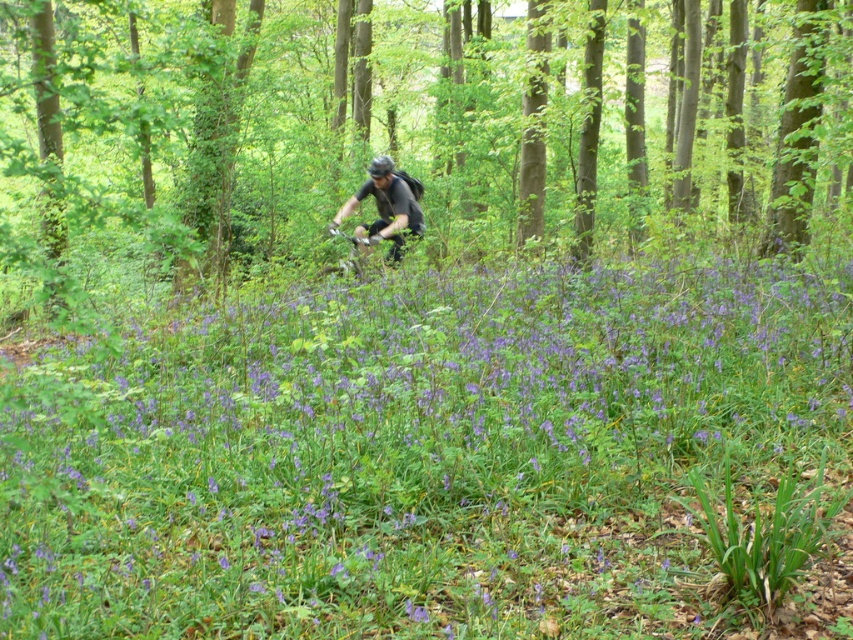
Does purple matte flowers at center have a smaller size compared to shiny black helmet at center?

Correct, purple matte flowers at center occupies less space than shiny black helmet at center.

Who is more distant from viewer, (663, 332) or (381, 168)?

The point (381, 168) is more distant.

Where is `purple matte flowers at center`? purple matte flowers at center is located at coordinates (415, 452).

Is purple matte flowers at center shorter than green leafy tree at center?

Indeed, purple matte flowers at center has a lesser height compared to green leafy tree at center.

Between purple matte flowers at center and green leafy tree at center, which one has less height?

purple matte flowers at center is shorter.

Between point (408, 563) and point (793, 49), which one is positioned behind?

The point (793, 49) is behind.

Locate an element on the screen. This screenshot has width=853, height=640. purple matte flowers at center is located at coordinates (415, 452).

Is green leafy tree at center thinner than shiny black helmet at center?

Incorrect, green leafy tree at center's width is not less than shiny black helmet at center's.

Does point (48, 200) lie behind point (387, 161)?

Yes, point (48, 200) is farther from viewer.

This screenshot has width=853, height=640. I want to click on green leafy tree at center, so click(399, 128).